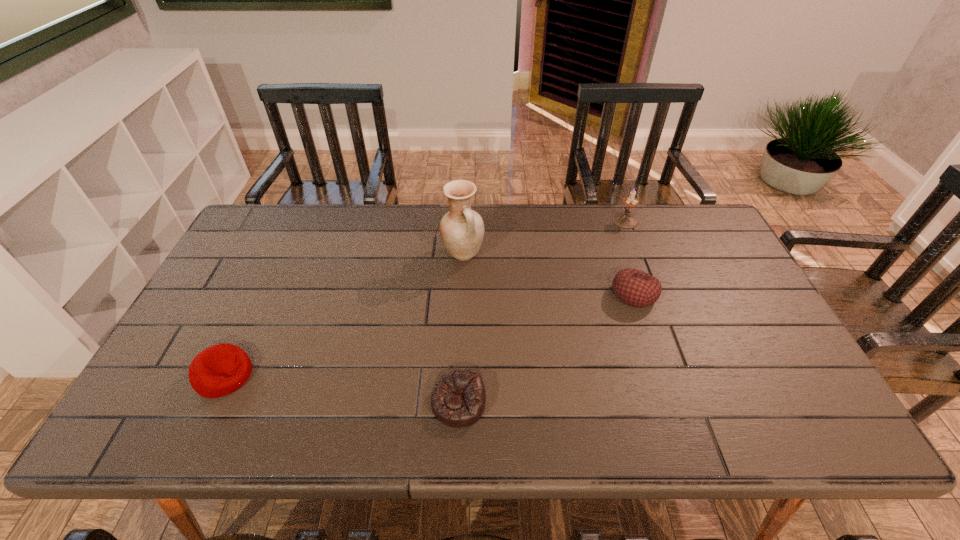
Find the location of a particular element. vacant area between the rightmost beanbag and the candle holder is located at coordinates (630, 258).

What are the coordinates of `vacant point located between the candle holder and the tallest object` in the screenshot? It's located at (544, 237).

Identify the location of vacant space in between the farthest object and the shortest object. The image size is (960, 540). (541, 312).

Locate an element on the screen. Image resolution: width=960 pixels, height=540 pixels. the fourth closest object to the rightmost beanbag is located at coordinates [219, 370].

Find the location of a particular element. object that ranks as the closest to the pottery is located at coordinates (635, 288).

Locate which beanbag ranks second in proximity to the leftmost object. Please provide its 2D coordinates. Your answer should be formatted as a tuple, i.e. [(x, y)], where the tuple contains the x and y coordinates of a point satisfying the conditions above.

[(635, 288)]

Locate which beanbag ranks in proximity to the rightmost beanbag. Please provide its 2D coordinates. Your answer should be formatted as a tuple, i.e. [(x, y)], where the tuple contains the x and y coordinates of a point satisfying the conditions above.

[(458, 399)]

You are a GUI agent. You are given a task and a screenshot of the screen. Output one action in this format:
    pyautogui.click(x=<x>, y=<y>)
    Task: Click on the free location that satisfies the following two spatial constraints: 1. on the front side of the farthest beanbag; 2. on the seat area of the leftmost object
    Image resolution: width=960 pixels, height=540 pixels.
    Given the screenshot: What is the action you would take?
    pyautogui.click(x=661, y=375)

Image resolution: width=960 pixels, height=540 pixels. I want to click on vacant region that satisfies the following two spatial constraints: 1. on the back side of the shortest beanbag; 2. on the seat area of the leftmost object, so click(x=460, y=375).

At what (x,y) coordinates should I click in order to perform the action: click on free point that satisfies the following two spatial constraints: 1. on the front side of the third nearest object; 2. on the seat area of the leftmost beanbag. Please return your answer as a coordinate pair (x, y). The image size is (960, 540). Looking at the image, I should click on (661, 375).